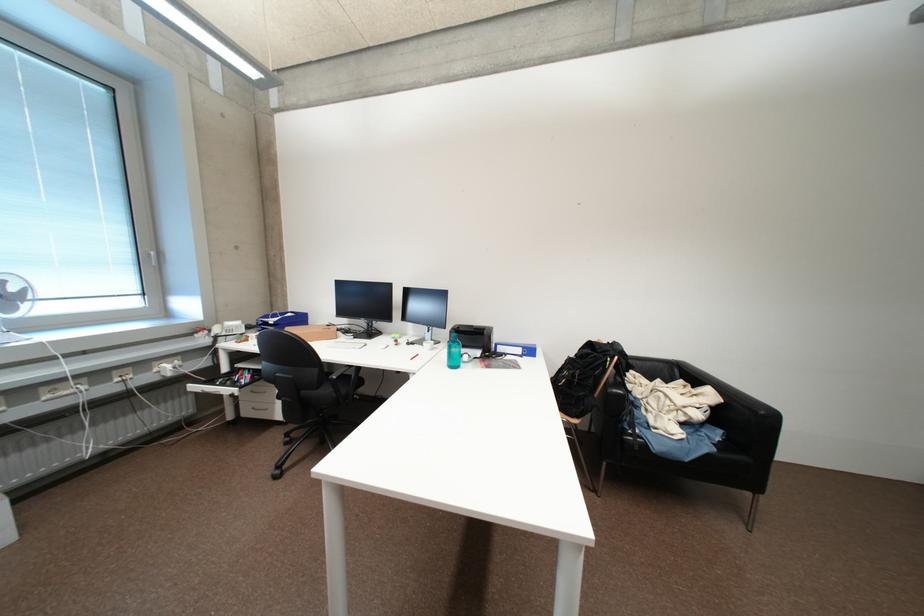
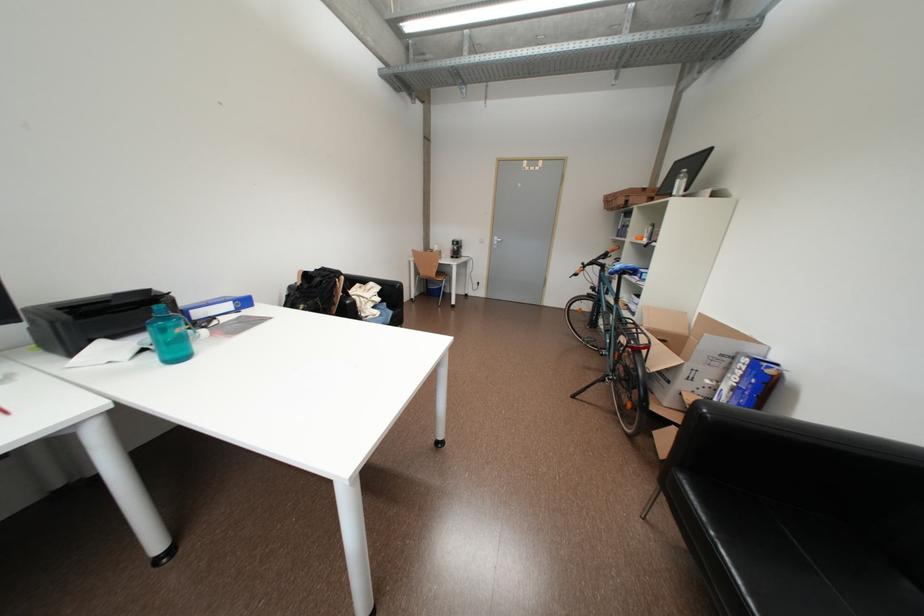
Find the pixel in the second image that matches point 462,368 in the first image.

(186, 360)